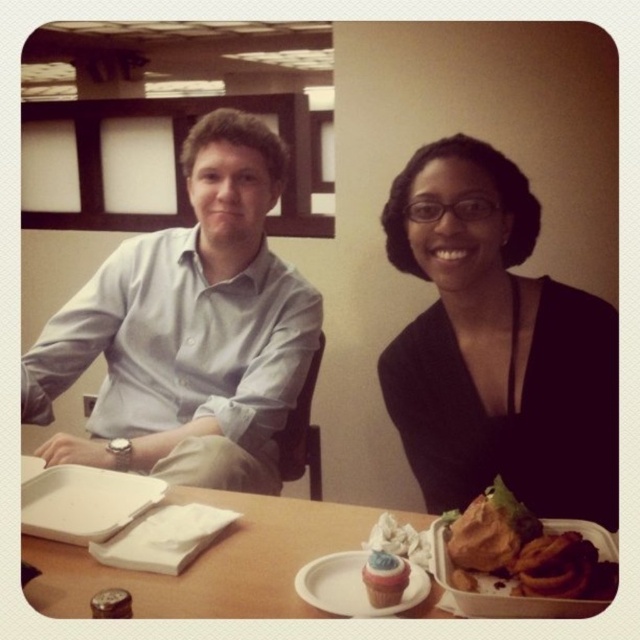
Question: Among these points, which one is farthest from the camera?

Choices:
 (A) pos(397,557)
 (B) pos(600,577)
 (C) pos(472,470)
 (D) pos(52,532)

Answer: (C)

Question: Among these points, which one is farthest from the camera?

Choices:
 (A) (385, 570)
 (B) (333, 580)

Answer: (B)

Question: Does golden brown crispy pastry at lower right have a larger size compared to white paper plate at center?

Choices:
 (A) no
 (B) yes

Answer: (B)

Question: Is matte white shirt at upper left below black matte dress at center?

Choices:
 (A) no
 (B) yes

Answer: (A)

Question: Is matte white shirt at upper left to the left of white plastic tray at center from the viewer's perspective?

Choices:
 (A) no
 (B) yes

Answer: (A)

Question: Which point is closer to the camera?

Choices:
 (A) (365, 564)
 (B) (72, 465)

Answer: (A)